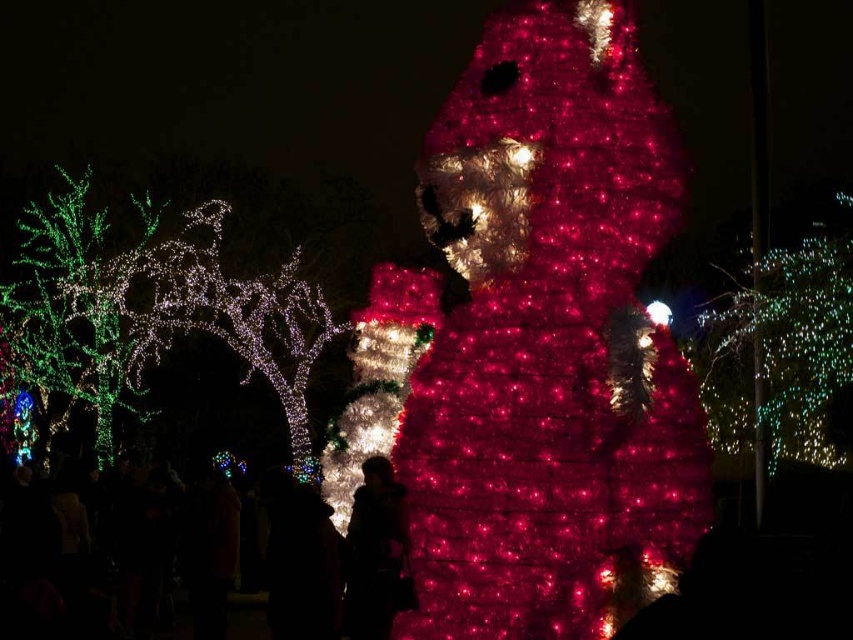
Question: Which of the following is the closest to the observer?

Choices:
 (A) (585, 589)
 (B) (390, 355)

Answer: (A)

Question: Which of the following is the closest to the observer?

Choices:
 (A) (621, 113)
 (B) (416, 326)

Answer: (A)

Question: Which point appears closest to the camera in this image?

Choices:
 (A) (344, 531)
 (B) (834, 284)
 (C) (357, 596)

Answer: (C)

Question: Can you confirm if green glittering lights at left is bigger than illuminated plastic christmas tree at center?

Choices:
 (A) no
 (B) yes

Answer: (B)

Question: Is shiny red lights at center closer to the viewer compared to green glittering lights at upper right?

Choices:
 (A) yes
 (B) no

Answer: (A)

Question: Is shiny red lights at center thinner than green wire tree at left?

Choices:
 (A) no
 (B) yes

Answer: (A)